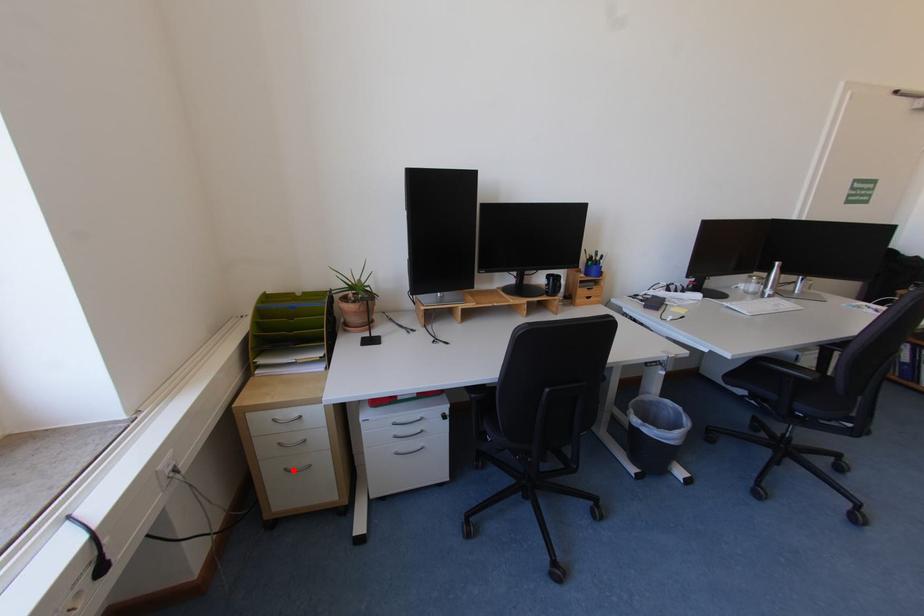
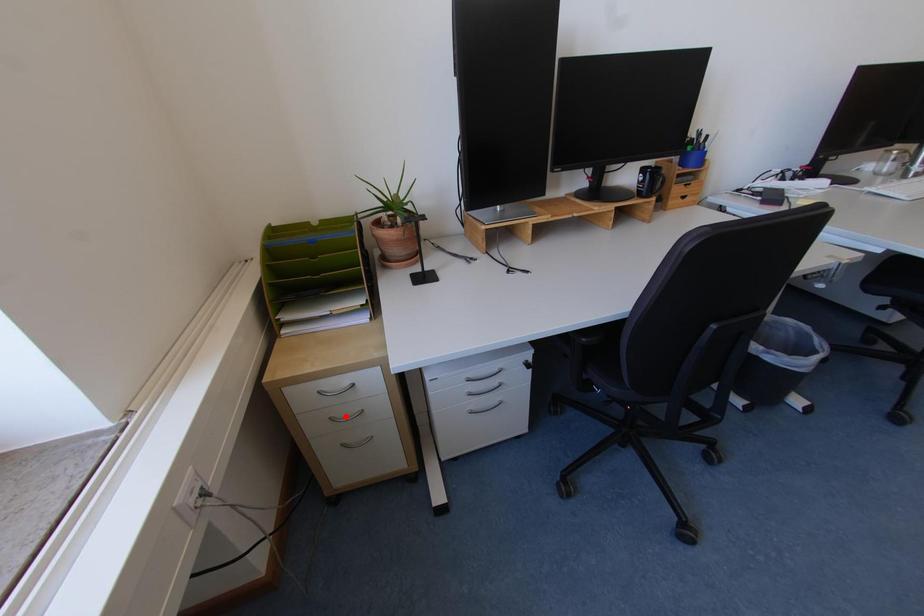
I am providing you with two images of the same scene from different viewpoints. A red point is marked on the first image and another point is marked on the second image. Do the highlighted points in image1 and image2 indicate the same real-world spot?

No